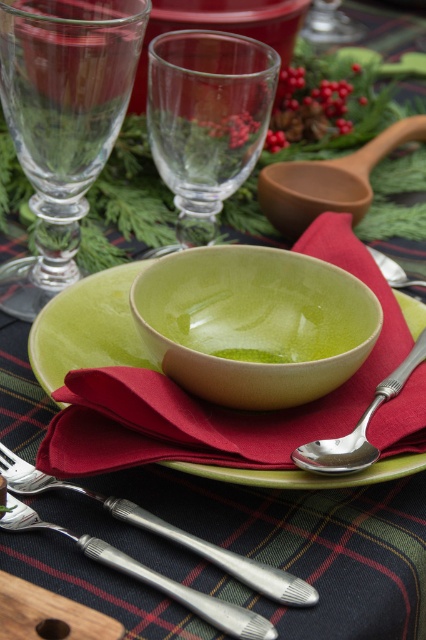
You are setting up a table for a dinner party and need to place a 10cm wide decorative item. You have two options on the table, the transparent glass wine glass at upper left and the silver polished fork at lower left. Which object can accommodate the item if placed next to it without overlapping?

The silver polished fork at lower left has a greater width than the transparent glass wine glass at upper left, so placing the 10cm wide decorative item next to the silver polished fork at lower left would be more accommodating without overlapping.

You are setting up a holiday table and want to place a decorative centerpiece. The table has a dark tartan tablecloth with a green ceramic bowl on a green plate at the center. There is also a transparent glass wine glass at upper left. Where should you place the centerpiece to avoid blocking the wine glass?

The transparent glass wine glass at upper left is located at point (62, 122), so place the centerpiece away from that coordinate to avoid blocking it.